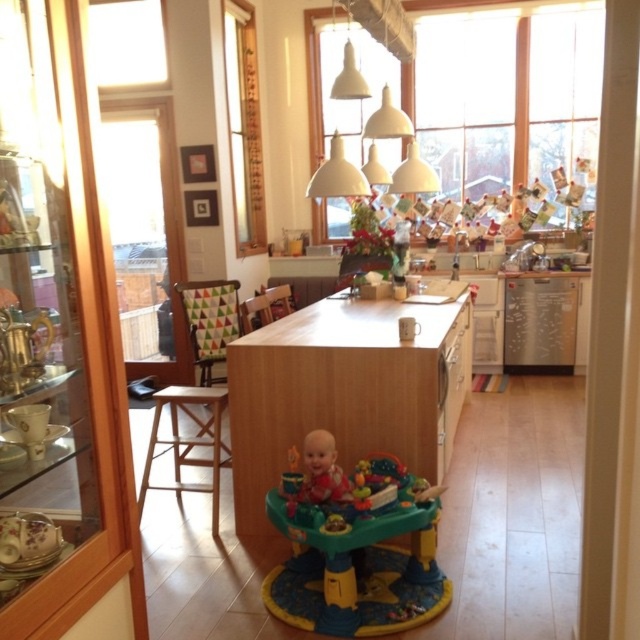
You are a parent trying to place the matte red baby walker at center and the wooden textured chair at center in the kitchen. Given their widths, which one can fit through a doorway that is 60 cm wide?

The matte red baby walker at center has a smaller width than the wooden textured chair at center, so it can fit through the 60 cm wide doorway.

You are standing in the kitchen and want to place a new decorative item exactly where the multicolored plastic walker at center is currently located. Where should you place it?

You should place the new decorative item at the coordinates point (355, 547) where the multicolored plastic walker at center is located.